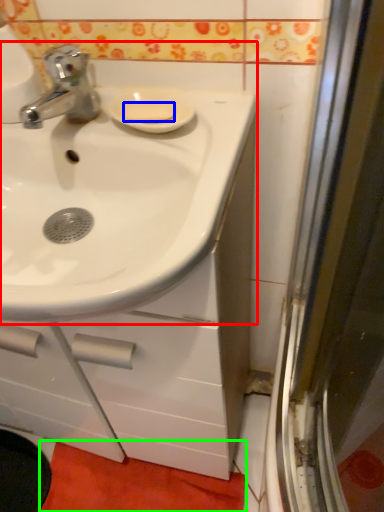
Question: Which object is the closest to the sink (highlighted by a red box)? Choose among these: soap (highlighted by a blue box) or bath mat (highlighted by a green box).

Choices:
 (A) soap
 (B) bath mat

Answer: (A)